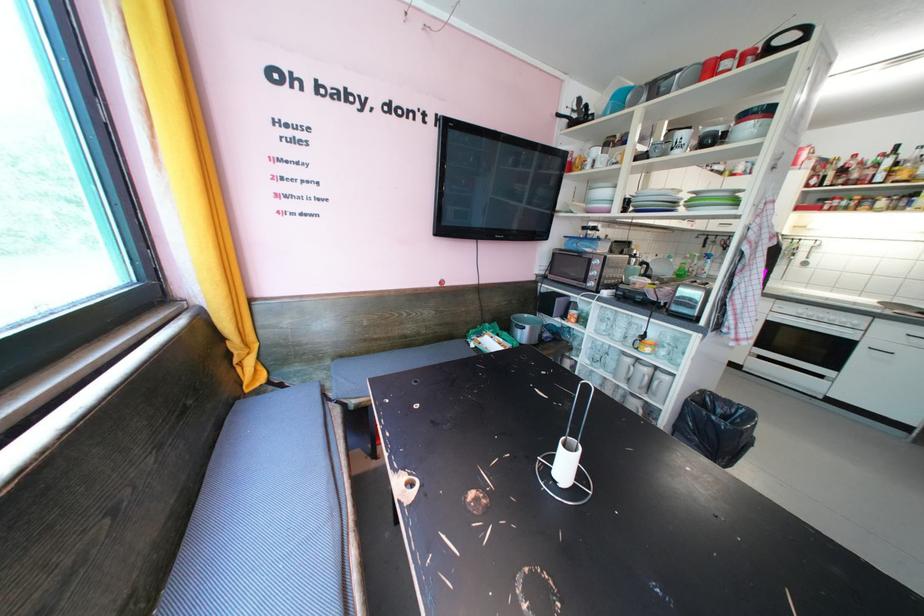
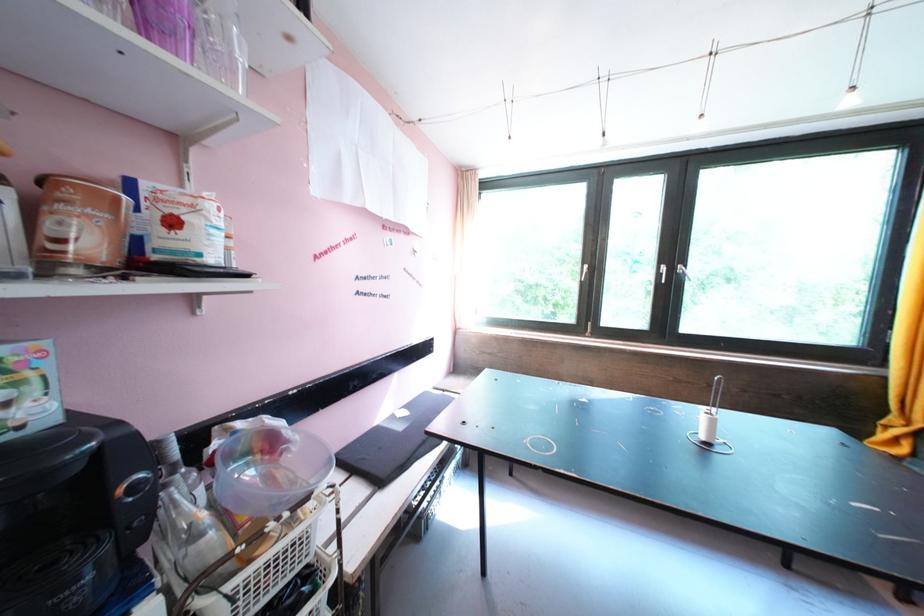
Question: I am providing you with two images of the same scene from different viewpoints. Please identify which objects are invisible in image2.

Choices:
 (A) bench sitting surface
 (B) purple plastic cup
 (C) silver camera tripod
 (D) brown coffee container

Answer: (A)